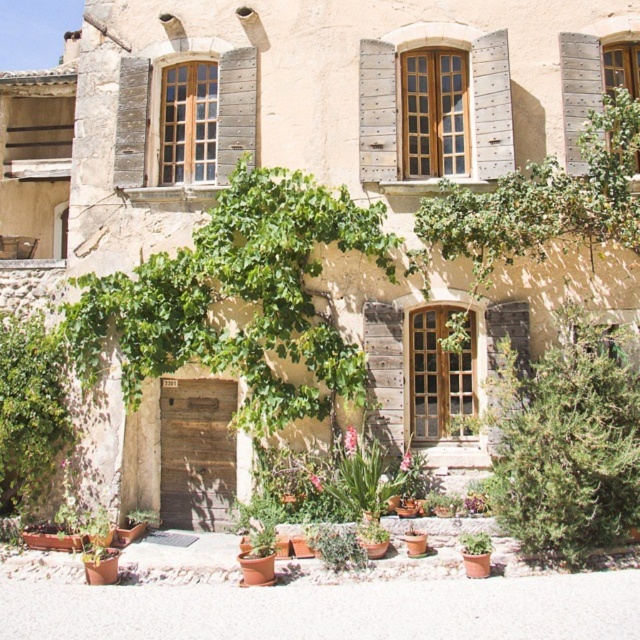
Question: From the image, what is the correct spatial relationship of green leafy plant at lower left in relation to green matte plant at lower center?

Choices:
 (A) below
 (B) above

Answer: (B)

Question: Is green matte plant at lower right positioned behind green matte plant at lower center?

Choices:
 (A) no
 (B) yes

Answer: (A)

Question: Which object is positioned farthest from the green matte plant at lower center?

Choices:
 (A) green matte plant at lower right
 (B) green leafy plant at lower left

Answer: (A)

Question: Which of the following is the farthest from the observer?

Choices:
 (A) (45, 474)
 (B) (129, 525)

Answer: (B)

Question: Which point appears closest to the camera in this image?

Choices:
 (A) (17, 365)
 (B) (326, 536)

Answer: (B)

Question: Is green leafy plant at lower left bigger than green matte plant at lower center?

Choices:
 (A) yes
 (B) no

Answer: (A)